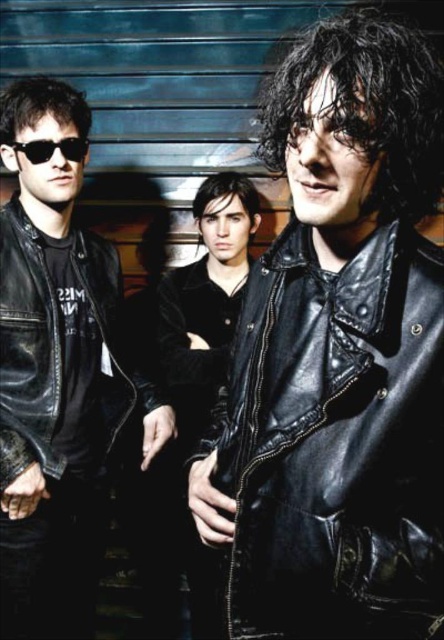
You are standing in front of the metallic background and want to place a small sticker between the two points, point (70, 163) and point (22, 141). Which point should the sticker be closer to so that it appears in front of both points from your viewing angle?

The sticker should be placed closer to point (22, 141) because point (70, 163) is behind point (22, 141), so placing it near the front point ensures visibility.

You are trying to locate the shiny black leather jacket at center in the image. According to the scene description, where is it positioned relative to the other individuals?

The shiny black leather jacket at center is located at point (335, 442), which places it centrally in the image between the three individuals.

You are a photographer adjusting your camera settings to capture the scene. You notice the matte black leather jacket at left and the black matte sunglasses at left. Which object should you focus on first if you want to ensure both are in sharp focus, considering their sizes?

The matte black leather jacket at left is much taller than the black matte sunglasses at left, so focusing on the larger object first would help ensure both are in focus.